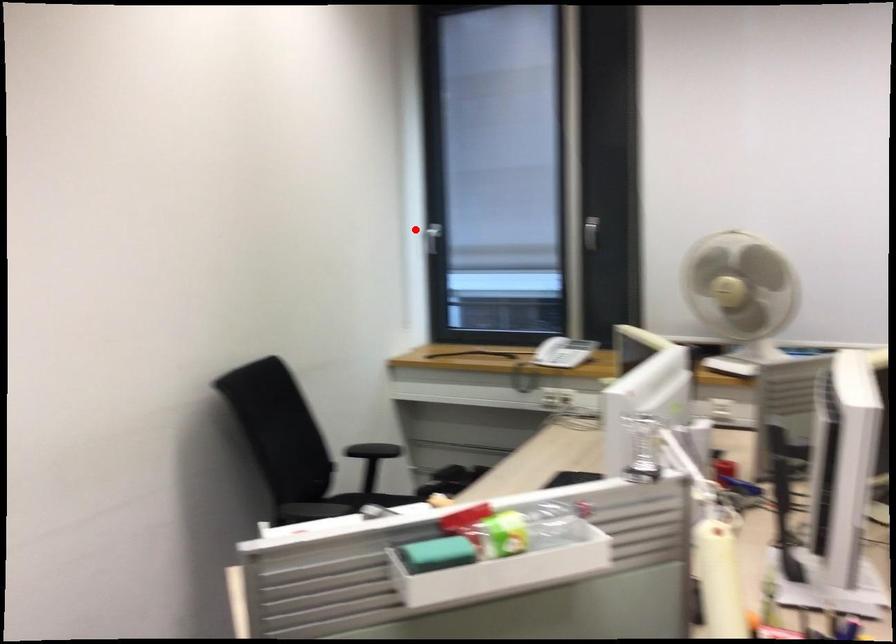
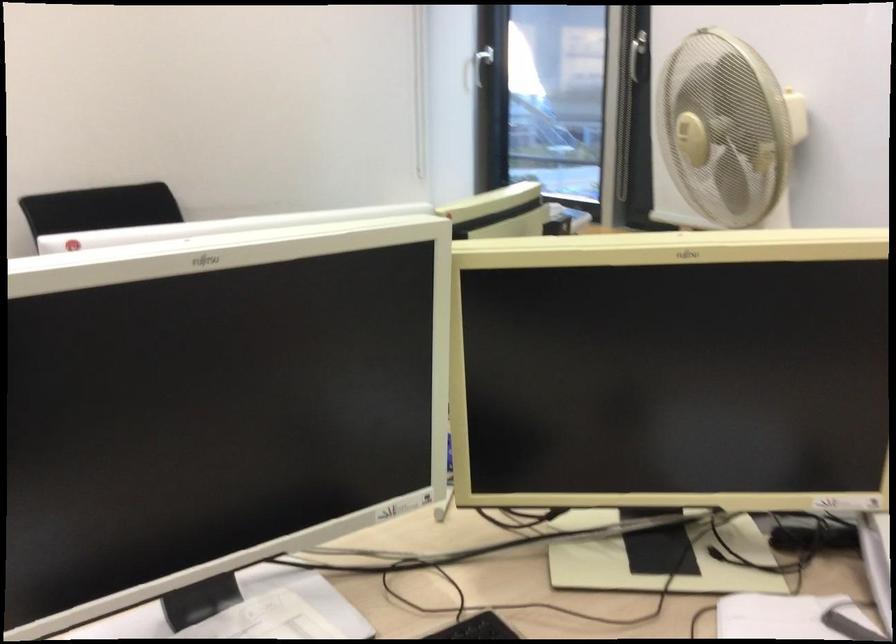
Locate, in the second image, the point that corresponds to the highlighted location in the first image.

(476, 69)